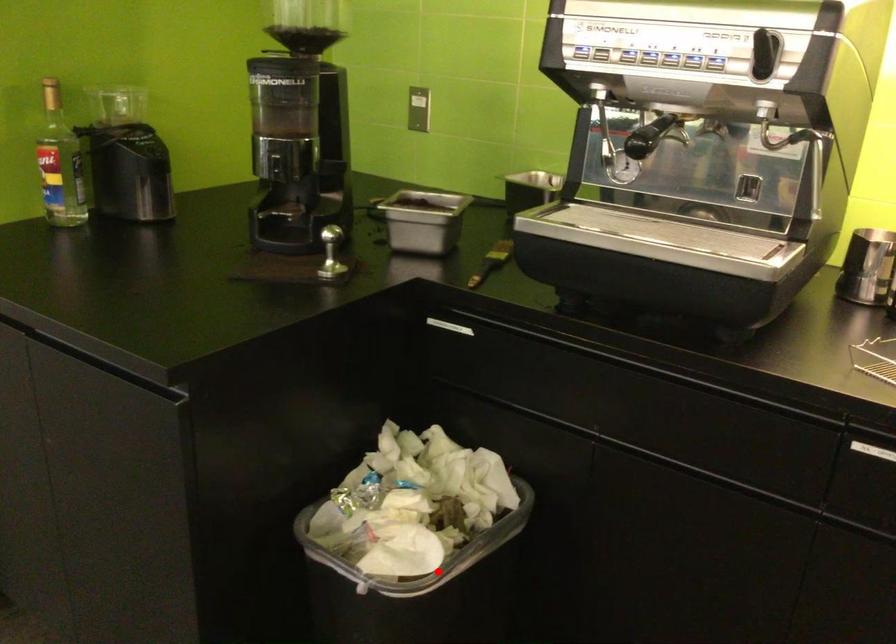
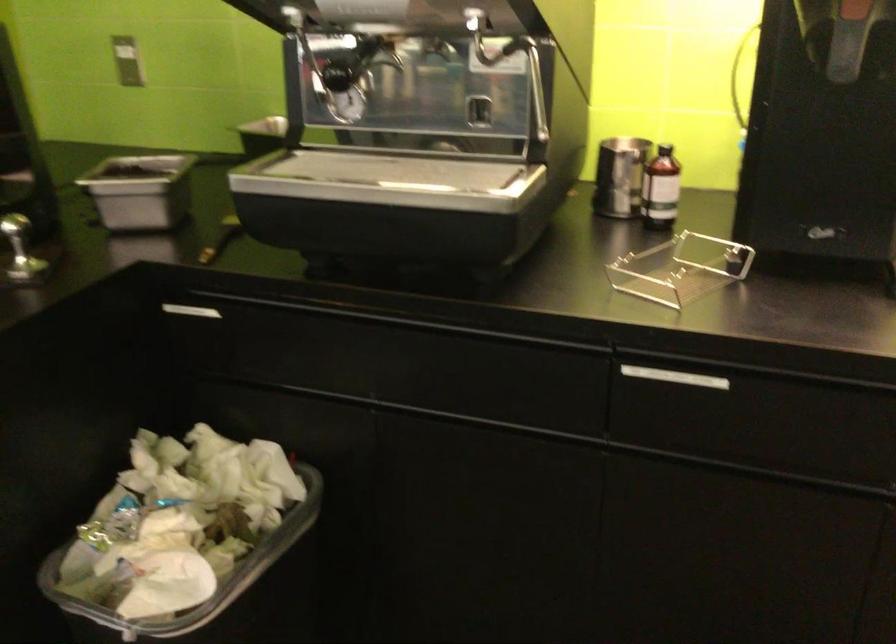
Question: A red point is marked in image1. In image2, is the corresponding 3D point closer to the camera or farther? Reply with the corresponding letter.

Choices:
 (A) The corresponding 3D point is closer.
 (B) The corresponding 3D point is farther.

Answer: (A)